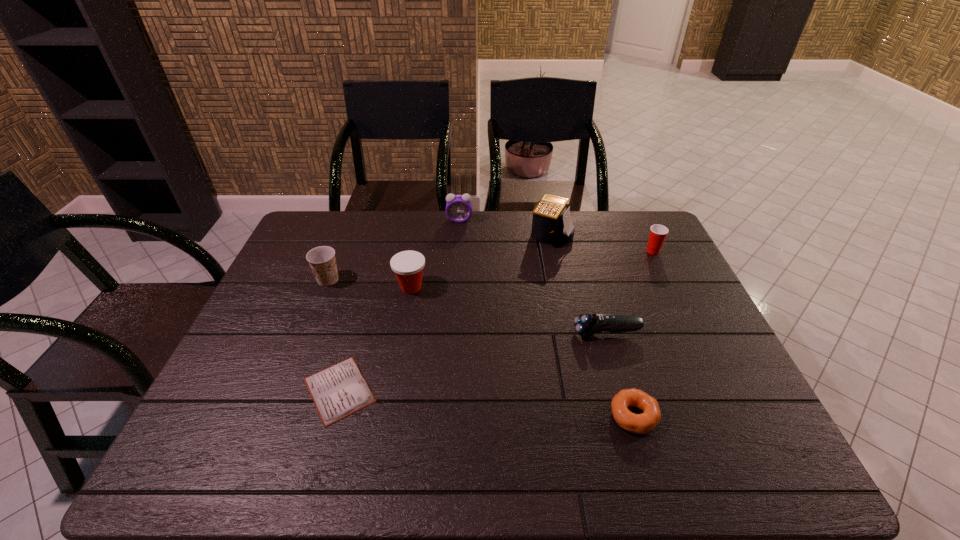
Identify the location of free spot that satisfies the following two spatial constraints: 1. on the head of the third shortest object; 2. on the back side of the second shortest object. The width and height of the screenshot is (960, 540). (631, 416).

What are the coordinates of `vacant point that satisfies the following two spatial constraints: 1. on the back side of the calculator; 2. on the right side of the diary` in the screenshot? It's located at (383, 234).